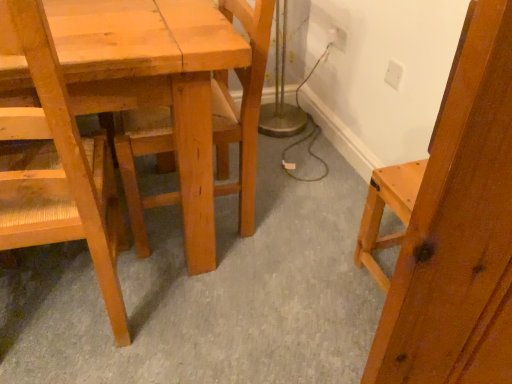
Image resolution: width=512 pixels, height=384 pixels. I want to click on vacant space to the right of natural wood chair at center, the 1th chair positioned from the right, so click(298, 211).